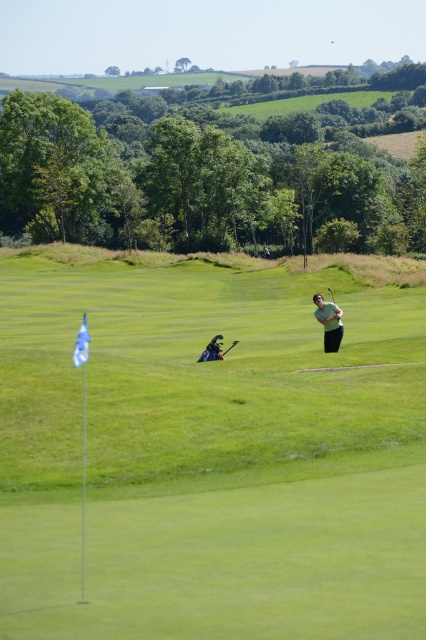
Consider the image. You are a golfer who wants to place your light brown leather golf club at center and dark green fabric jacket at center on the fairway without overlapping. Which object should you place first to ensure they both fit side by side?

The light brown leather golf club at center has a smaller width than the dark green fabric jacket at center, so you should place the dark green fabric jacket at center first to leave enough space for both items side by side.

You are a golfer trying to position yourself exactly at the center of the fairway. The dark green fabric jacket at center is currently at point 0.547, 0.498. Is the jacket positioned at the center of the fairway?

The dark green fabric jacket at center is located at coordinates (x=212, y=349), which indicates it is positioned at the center of the fairway.